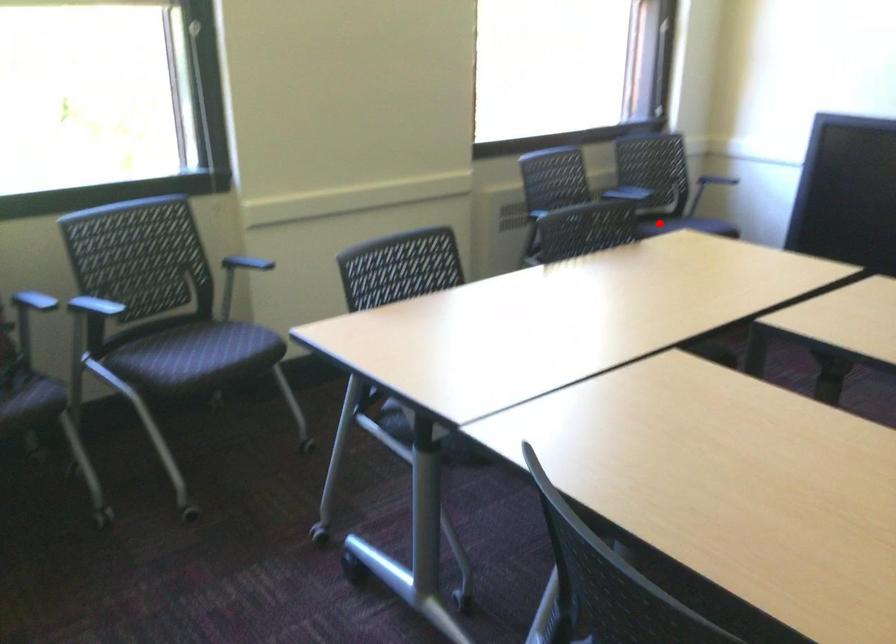
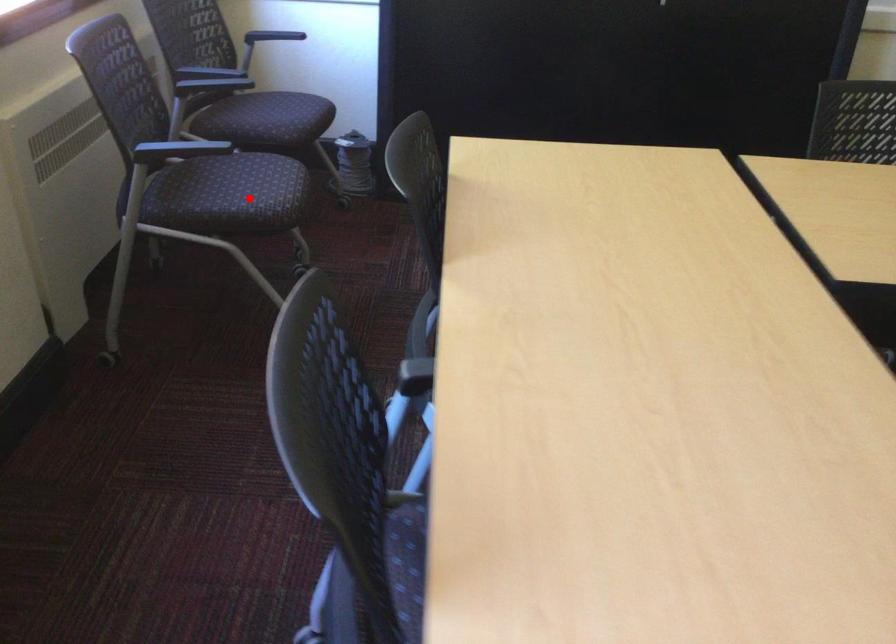
I am providing you with two images of the same scene from different viewpoints. A red point is marked on the first image and another point is marked on the second image. Is the marked point in image1 the same physical position as the marked point in image2?

No